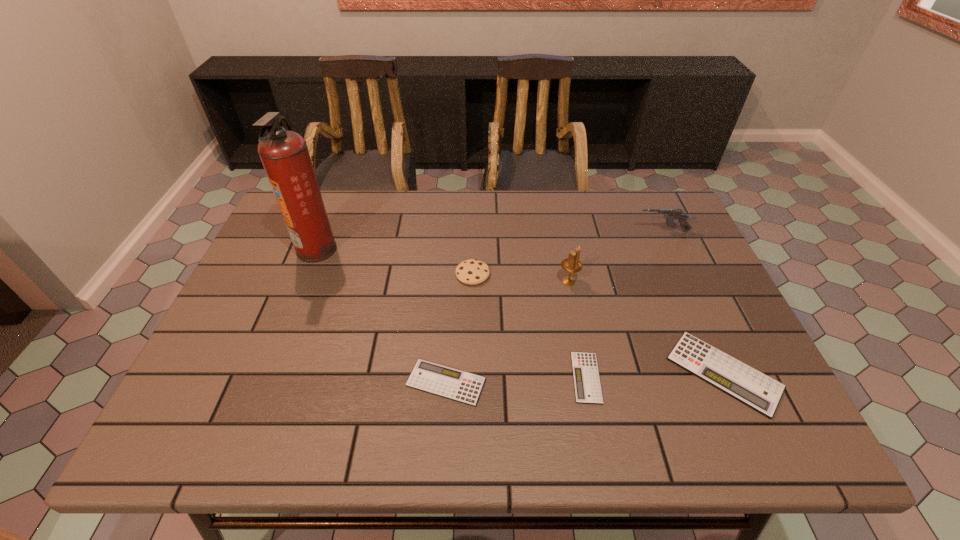
Find the location of a particular element. This screenshot has height=540, width=960. free space at the left edge of the desktop is located at coordinates (207, 360).

Identify the location of vacant space at the right edge of the desktop. (730, 315).

Locate an element on the screen. This screenshot has height=540, width=960. vacant area at the near left corner of the desktop is located at coordinates (241, 369).

The image size is (960, 540). In order to click on vacant space that's between the third shortest object and the cookie in this screenshot , I will do `click(598, 323)`.

Identify the location of vacant area that lies between the third tallest object and the rightmost calculator. Image resolution: width=960 pixels, height=540 pixels. (693, 302).

The image size is (960, 540). I want to click on vacant point located between the leftmost object and the tallest calculator, so click(x=520, y=310).

Find the location of `free space between the fifth shortest object and the fourth shortest object`. free space between the fifth shortest object and the fourth shortest object is located at coordinates (567, 253).

You are a GUI agent. You are given a task and a screenshot of the screen. Output one action in this format:
    pyautogui.click(x=<x>, y=<y>)
    Task: Click on the empty location between the shortest object and the candle holder
    Image resolution: width=960 pixels, height=540 pixels.
    Given the screenshot: What is the action you would take?
    pyautogui.click(x=578, y=329)

The height and width of the screenshot is (540, 960). I want to click on vacant area that lies between the candle holder and the fourth shortest object, so click(520, 278).

The height and width of the screenshot is (540, 960). What are the coordinates of `vacant space in between the leftmost object and the third tallest object` in the screenshot? It's located at (490, 240).